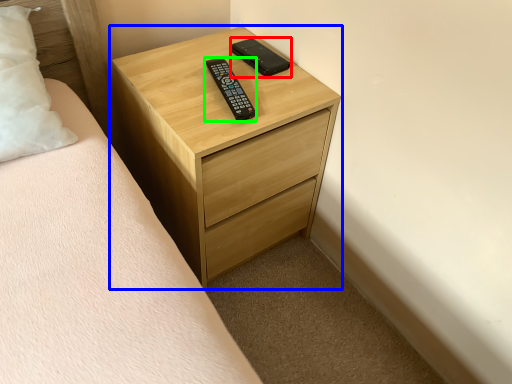
Question: Which is farther away from control (highlighted by a red box)? chest of drawers (highlighted by a blue box) or control (highlighted by a green box)?

Choices:
 (A) chest of drawers
 (B) control

Answer: (A)